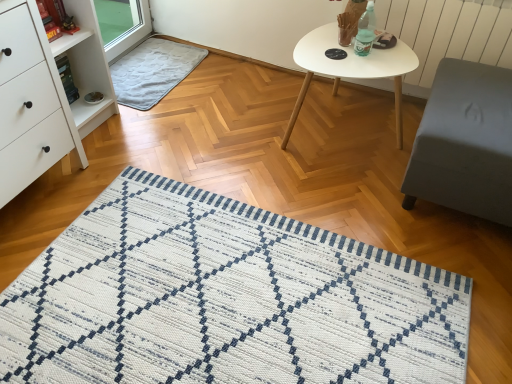
The image size is (512, 384). In order to click on vacant space that's between white matte oval table at upper center and gray matte ottoman at right in this screenshot , I will do `click(347, 177)`.